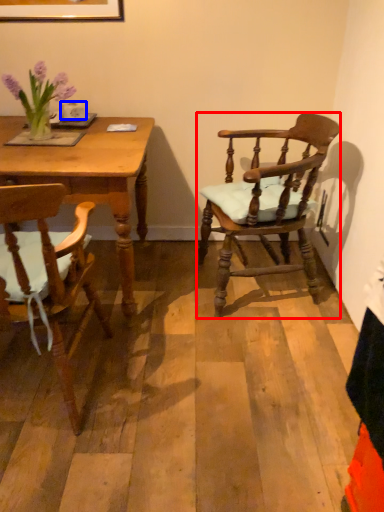
Question: Which object appears farthest to the camera in this image, chair (highlighted by a red box) or coffee cup (highlighted by a blue box)?

Choices:
 (A) chair
 (B) coffee cup

Answer: (B)